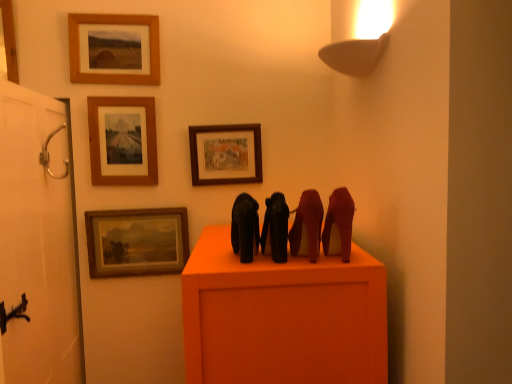
Question: In terms of width, does silver metallic door handle at left look wider or thinner when compared to brushed metal picture frame at upper left, the fifth picture frame in the right-to-left sequence?

Choices:
 (A) thin
 (B) wide

Answer: (B)

Question: Based on their sizes in the image, would you say silver metallic door handle at left is bigger or smaller than brushed metal picture frame at upper left, which appears as the 1th picture frame when viewed from the left?

Choices:
 (A) big
 (B) small

Answer: (B)

Question: Which object is positioned closest to the silver metallic door handle at left?

Choices:
 (A) black matte elephant at center, marked as the 3th animal in a right-to-left arrangement
 (B) satin red high-heels at right, the 4th animal viewed from the left
 (C) shiny black high-heels at center, placed as the second animal when sorted from right to left
 (D) brushed metal picture frame at upper left, the fifth picture frame in the right-to-left sequence
 (E) wooden picture frame at upper center, the 5th picture frame viewed from the left

Answer: (D)

Question: Which object is positioned closest to the wooden picture frame at upper center, the 5th picture frame viewed from the left?

Choices:
 (A) silver metallic door handle at left
 (B) brushed metal picture frame at upper left, the fifth picture frame in the right-to-left sequence
 (C) black matte elephant at center, marked as the second animal in a left-to-right arrangement
 (D) wooden picture frame at upper left, the second picture frame from the left
 (E) wooden frame at upper center, the 3th picture frame in the right-to-left sequence

Answer: (E)